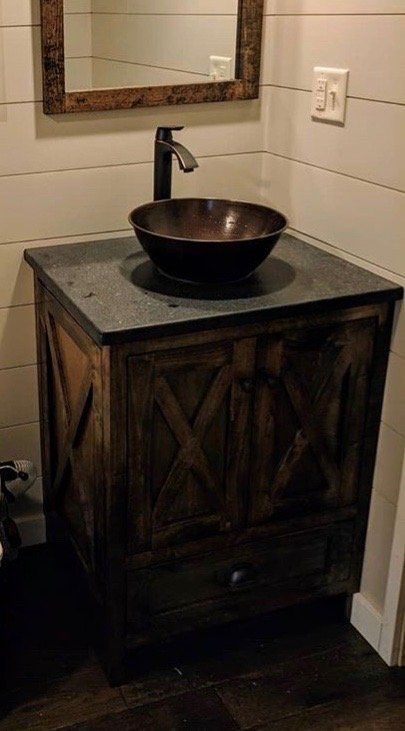
This screenshot has height=731, width=405. I want to click on tabletop, so click(92, 265), click(125, 318), click(246, 303), click(321, 292), click(294, 254).